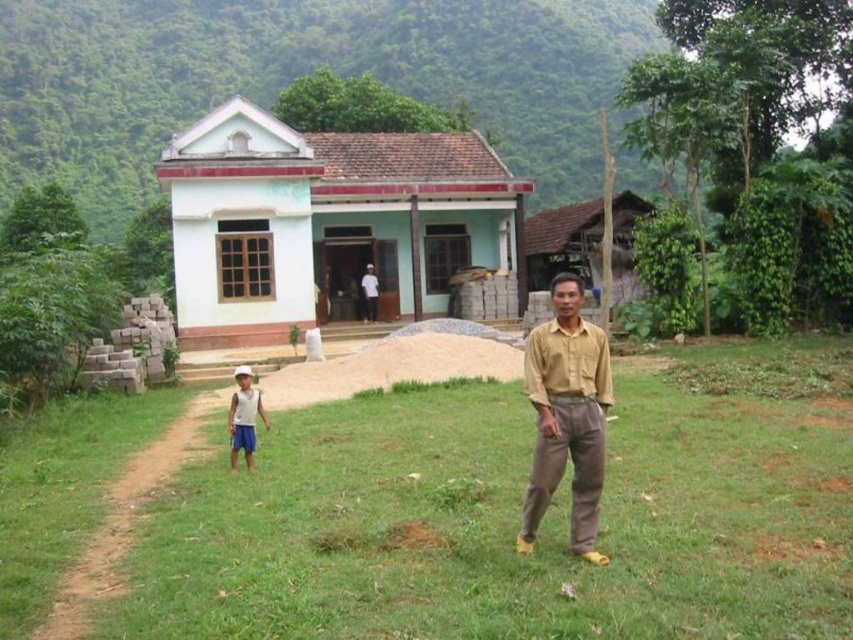
Which is behind, point (393, 268) or point (247, 424)?

The point (393, 268) is more distant.

Between light blue painted wood house at center and white cotton shirt at lower left, which one is positioned lower?

white cotton shirt at lower left

Measure the distance between point (422, 138) and camera.

88.64 feet

Locate an element on the screen. The height and width of the screenshot is (640, 853). light blue painted wood house at center is located at coordinates (325, 220).

Based on the photo, between green grass at center and yellow cotton shirt at center, which one has less height?

With less height is green grass at center.

Locate an element on the screen. green grass at center is located at coordinates (515, 518).

Is green grass at center below white cotton shirt at lower left?

Indeed, green grass at center is positioned under white cotton shirt at lower left.

Who is taller, green grass at center or white cotton shirt at lower left?

With more height is white cotton shirt at lower left.

Image resolution: width=853 pixels, height=640 pixels. I want to click on green grass at center, so click(x=515, y=518).